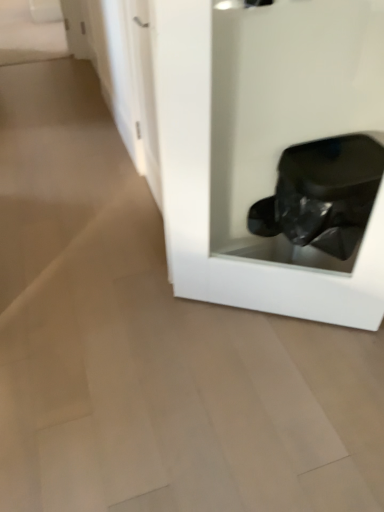
The width and height of the screenshot is (384, 512). I want to click on free space in front of transparent glossy trash can at lower right, so click(x=265, y=401).